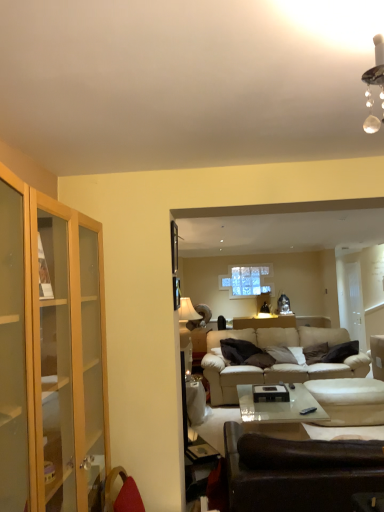
Find the location of a particular element. beige fabric swivel chair at lower right is located at coordinates (353, 394).

At what (x,y) coordinates should I click in order to perform the action: click on beige leather couch at center, placed as the 2th studio couch when sorted from front to back. Please return your answer as a coordinate pair (x, y). Looking at the image, I should click on (277, 364).

You are a GUI agent. You are given a task and a screenshot of the screen. Output one action in this format:
    pyautogui.click(x=<x>, y=<y>)
    Task: Click on the dark gray fabric pillow at center
    
    Given the screenshot: What is the action you would take?
    pyautogui.click(x=315, y=352)

The image size is (384, 512). In order to click on beige fabric swivel chair at lower right in this screenshot , I will do [353, 394].

Is leather couch at lower right, which ranks as the second studio couch in back-to-front order, oriented towards beige fabric armchair at right?

Yes, leather couch at lower right, which ranks as the second studio couch in back-to-front order, faces towards beige fabric armchair at right.

How many degrees apart are the facing directions of leather couch at lower right, which ranks as the second studio couch in back-to-front order, and beige fabric armchair at right?

There is a 88-degree angle between the facing directions of leather couch at lower right, which ranks as the second studio couch in back-to-front order, and beige fabric armchair at right.

Does leather couch at lower right, which ranks as the second studio couch in back-to-front order, come behind beige fabric armchair at right?

No.

From the image's perspective, is leather couch at lower right, which ranks as the 1th studio couch in front-to-back order, positioned above or below beige fabric armchair at right?

leather couch at lower right, which ranks as the 1th studio couch in front-to-back order, is above beige fabric armchair at right.

Is leather couch at lower right, which ranks as the 1th studio couch in front-to-back order, closer to camera compared to beige leather couch at center, placed as the 2th studio couch when sorted from front to back?

Yes, it is.

I want to click on studio couch in front of the beige leather couch at center, placed as the 2th studio couch when sorted from front to back, so click(x=298, y=472).

Between leather couch at lower right, which ranks as the 1th studio couch in front-to-back order, and beige leather couch at center, placed as the 2th studio couch when sorted from front to back, which one has larger width?

With larger width is beige leather couch at center, placed as the 2th studio couch when sorted from front to back.

From the image's perspective, between leather couch at lower right, which ranks as the 1th studio couch in front-to-back order, and beige leather couch at center, the first studio couch when ordered from back to front, which one is located above?

leather couch at lower right, which ranks as the 1th studio couch in front-to-back order, appears higher in the image.

Can you confirm if beige fabric swivel chair at lower right is bigger than beige fabric armchair at right?

Yes.

Would you say beige fabric swivel chair at lower right is to the left or to the right of beige fabric armchair at right in the picture?

Based on their positions, beige fabric swivel chair at lower right is located to the left of beige fabric armchair at right.

I want to click on swivel chair that is below the beige fabric armchair at right (from the image's perspective), so click(x=353, y=394).

From the image's perspective, which one is positioned lower, beige fabric swivel chair at lower right or beige fabric armchair at right?

beige fabric swivel chair at lower right appears lower in the image.

At what (x,y) coordinates should I click in order to perform the action: click on swivel chair that appears below the leather couch at lower right, which ranks as the second studio couch in back-to-front order (from the image's perspective). Please return your answer as a coordinate pair (x, y). Looking at the image, I should click on (353, 394).

From a real-world perspective, is beige fabric swivel chair at lower right beneath leather couch at lower right, which ranks as the second studio couch in back-to-front order?

Correct, in the physical world, beige fabric swivel chair at lower right is lower than leather couch at lower right, which ranks as the second studio couch in back-to-front order.

Which of these two, beige fabric swivel chair at lower right or leather couch at lower right, which ranks as the 1th studio couch in front-to-back order, is smaller?

beige fabric swivel chair at lower right is smaller.

Is leather couch at lower right, which ranks as the second studio couch in back-to-front order, a part of beige fabric swivel chair at lower right?

That's incorrect, leather couch at lower right, which ranks as the second studio couch in back-to-front order, is not inside beige fabric swivel chair at lower right.

Between beige fabric swivel chair at lower right and dark gray fabric pillow at center, which one appears on the right side from the viewer's perspective?

Positioned to the right is beige fabric swivel chair at lower right.

Considering the sizes of beige fabric swivel chair at lower right and dark gray fabric pillow at center in the image, is beige fabric swivel chair at lower right taller or shorter than dark gray fabric pillow at center?

beige fabric swivel chair at lower right is taller than dark gray fabric pillow at center.

Which is more distant, (x=382, y=393) or (x=312, y=361)?

Positioned behind is point (x=312, y=361).

From a real-world perspective, which is physically below, beige fabric swivel chair at lower right or dark gray fabric pillow at center?

From a 3D spatial view, beige fabric swivel chair at lower right is below.

From the image's perspective, is beige leather couch at center, the first studio couch when ordered from back to front, above dark gray fabric pillow at center?

Incorrect, from the image's perspective, beige leather couch at center, the first studio couch when ordered from back to front, is lower than dark gray fabric pillow at center.

Which is in front, point (209, 332) or point (317, 358)?

The point (317, 358) is closer to the camera.

Is beige leather couch at center, the first studio couch when ordered from back to front, thinner than dark gray fabric pillow at center?

No.

Could you measure the distance between beige leather couch at center, placed as the 2th studio couch when sorted from front to back, and dark gray fabric pillow at center?

beige leather couch at center, placed as the 2th studio couch when sorted from front to back, is 33.50 inches from dark gray fabric pillow at center.

Is beige leather couch at center, placed as the 2th studio couch when sorted from front to back, turned away from leather couch at lower right, which ranks as the 1th studio couch in front-to-back order?

No, leather couch at lower right, which ranks as the 1th studio couch in front-to-back order, is not at the back of beige leather couch at center, placed as the 2th studio couch when sorted from front to back.

Is beige leather couch at center, placed as the 2th studio couch when sorted from front to back, to the right of leather couch at lower right, which ranks as the 1th studio couch in front-to-back order, from the viewer's perspective?

Indeed, beige leather couch at center, placed as the 2th studio couch when sorted from front to back, is positioned on the right side of leather couch at lower right, which ranks as the 1th studio couch in front-to-back order.

Which of these two, beige leather couch at center, the first studio couch when ordered from back to front, or leather couch at lower right, which ranks as the 1th studio couch in front-to-back order, stands shorter?

Standing shorter between the two is leather couch at lower right, which ranks as the 1th studio couch in front-to-back order.

This screenshot has width=384, height=512. I want to click on armchair below the leather couch at lower right, which ranks as the second studio couch in back-to-front order (from the image's perspective), so click(377, 356).

Where is `studio couch behind the leather couch at lower right, which ranks as the second studio couch in back-to-front order`? studio couch behind the leather couch at lower right, which ranks as the second studio couch in back-to-front order is located at coordinates (277, 364).

Considering their positions, is beige fabric armchair at right positioned further to leather couch at lower right, which ranks as the 1th studio couch in front-to-back order, than dark gray fabric pillow at center?

dark gray fabric pillow at center lies further to leather couch at lower right, which ranks as the 1th studio couch in front-to-back order, than the other object.

Considering their positions, is beige leather couch at center, the first studio couch when ordered from back to front, positioned closer to dark gray fabric pillow at center than leather couch at lower right, which ranks as the second studio couch in back-to-front order?

The object closer to dark gray fabric pillow at center is beige leather couch at center, the first studio couch when ordered from back to front.

Which object lies further to the anchor point beige fabric armchair at right, beige leather couch at center, placed as the 2th studio couch when sorted from front to back, or leather couch at lower right, which ranks as the second studio couch in back-to-front order?

leather couch at lower right, which ranks as the second studio couch in back-to-front order.

Looking at the image, which one is located further to dark gray fabric pillow at center, beige fabric armchair at right or beige fabric swivel chair at lower right?

Based on the image, beige fabric swivel chair at lower right appears to be further to dark gray fabric pillow at center.

From the image, which object appears to be nearer to beige fabric armchair at right, beige leather couch at center, the first studio couch when ordered from back to front, or beige fabric swivel chair at lower right?

Among the two, beige fabric swivel chair at lower right is located nearer to beige fabric armchair at right.

From the image, which object appears to be farther from beige fabric swivel chair at lower right, beige leather couch at center, the first studio couch when ordered from back to front, or dark gray fabric pillow at center?

dark gray fabric pillow at center.

Looking at the image, which one is located closer to beige fabric armchair at right, leather couch at lower right, which ranks as the second studio couch in back-to-front order, or beige leather couch at center, placed as the 2th studio couch when sorted from front to back?

beige leather couch at center, placed as the 2th studio couch when sorted from front to back, is closer to beige fabric armchair at right.

Estimate the real-world distances between objects in this image. Which object is further from beige fabric armchair at right, dark gray fabric pillow at center or leather couch at lower right, which ranks as the second studio couch in back-to-front order?

leather couch at lower right, which ranks as the second studio couch in back-to-front order.

What are the coordinates of `pillow positioned between beige fabric swivel chair at lower right and beige fabric armchair at right from near to far` in the screenshot? It's located at (315, 352).

This screenshot has height=512, width=384. In order to click on pillow between leather couch at lower right, which ranks as the second studio couch in back-to-front order, and beige fabric armchair at right in the front-back direction in this screenshot , I will do `click(315, 352)`.

Where is `swivel chair located between leather couch at lower right, which ranks as the second studio couch in back-to-front order, and beige fabric armchair at right in the depth direction`? Image resolution: width=384 pixels, height=512 pixels. swivel chair located between leather couch at lower right, which ranks as the second studio couch in back-to-front order, and beige fabric armchair at right in the depth direction is located at coordinates (353, 394).

You are a GUI agent. You are given a task and a screenshot of the screen. Output one action in this format:
    pyautogui.click(x=<x>, y=<y>)
    Task: Click on the swivel chair between leather couch at lower right, which ranks as the second studio couch in back-to-front order, and dark gray fabric pillow at center from front to back
    Image resolution: width=384 pixels, height=512 pixels.
    Given the screenshot: What is the action you would take?
    pyautogui.click(x=353, y=394)